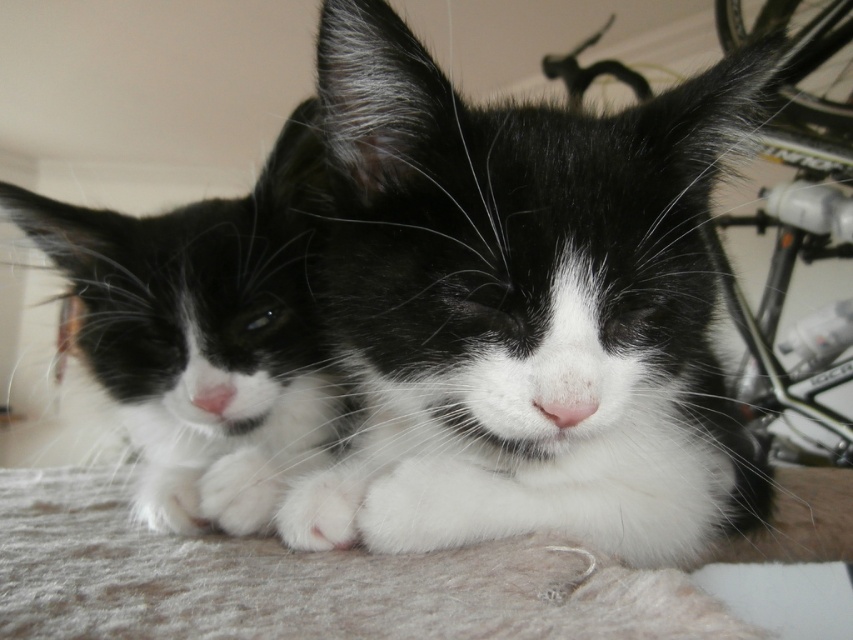
Does point (436, 444) come farther from viewer compared to point (289, 205)?

No.

Can you confirm if black soft fur cat at center is thinner than soft fur cat at center?

No.

Is point (636, 369) more distant than point (161, 444)?

That is False.

This screenshot has height=640, width=853. What are the coordinates of `black soft fur cat at center` in the screenshot? It's located at (524, 310).